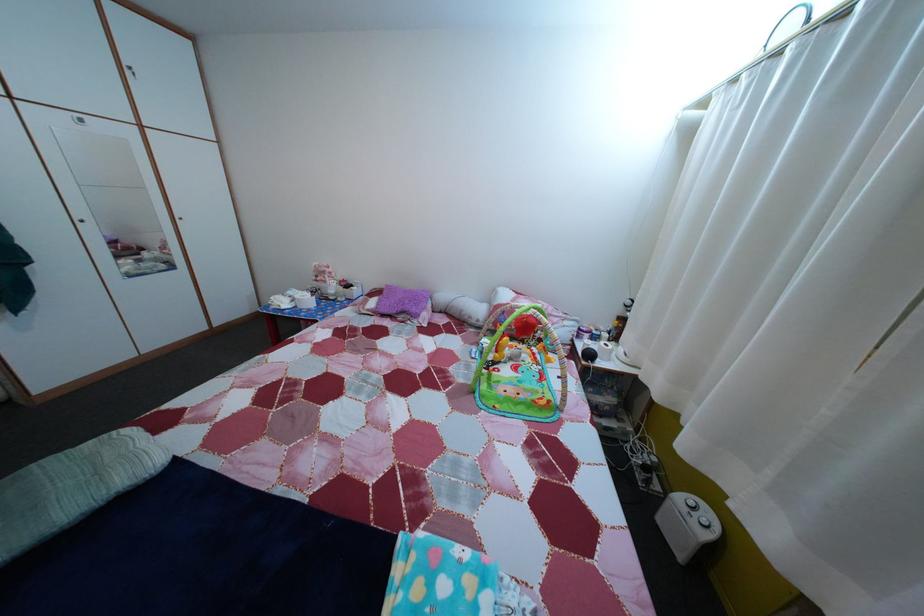
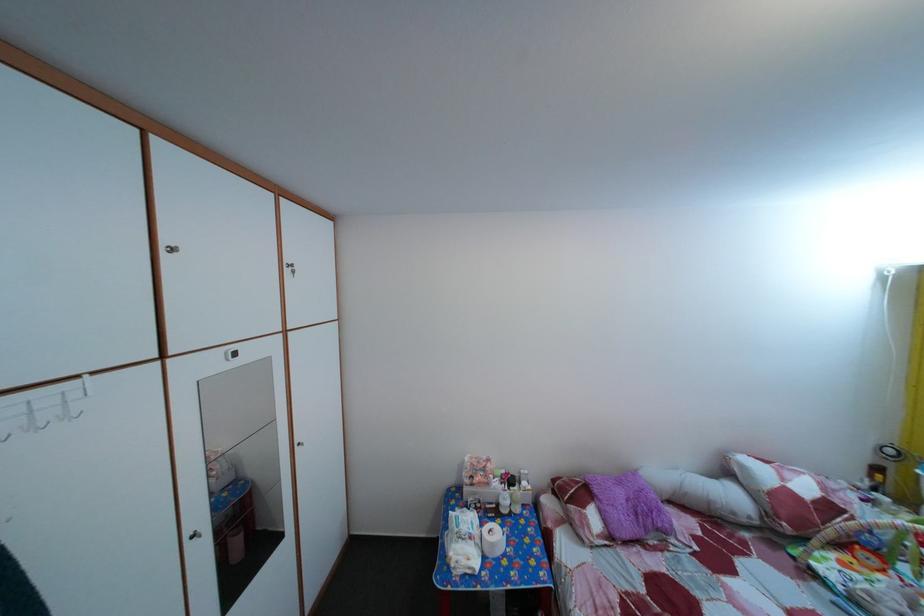
Find the pixel in the second image that matches point (416, 299) in the first image.

(629, 491)